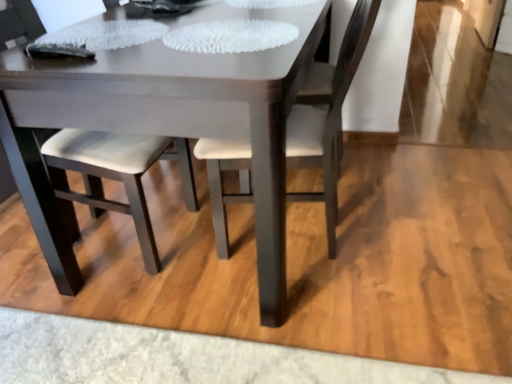
In order to face white leather chair at center, which is the 2th chair in left-to-right order, should I rotate leftwards or rightwards?

Turn right approximately 3.893 degrees to face it.

This screenshot has height=384, width=512. I want to click on white leather chair at center, placed as the first chair when sorted from right to left, so click(x=327, y=115).

Identify the location of matte white table at center. The height and width of the screenshot is (384, 512). (165, 123).

Between matte white chair at center, which appears as the 2th chair when viewed from the right, and matte white table at center, which one has smaller width?

With smaller width is matte white chair at center, which appears as the 2th chair when viewed from the right.

Is matte white chair at center, placed as the 1th chair when sorted from left to right, with matte white table at center?

No.

From a real-world perspective, which is physically above, matte white chair at center, which appears as the 2th chair when viewed from the right, or matte white table at center?

matte white chair at center, which appears as the 2th chair when viewed from the right, is physically above.

Can you tell me how much matte white chair at center, placed as the 1th chair when sorted from left to right, and matte white table at center differ in facing direction?

The angle between the facing direction of matte white chair at center, placed as the 1th chair when sorted from left to right, and the facing direction of matte white table at center is 2.28 degrees.

Consider the image. Between white leather chair at center, placed as the first chair when sorted from right to left, and matte white chair at center, placed as the 1th chair when sorted from left to right, which one is positioned behind?

white leather chair at center, placed as the first chair when sorted from right to left, is further away from the camera.

Considering the points (331, 145) and (190, 196), which point is behind, point (331, 145) or point (190, 196)?

The point (190, 196) is more distant.

How much distance is there between white leather chair at center, which is the 2th chair in left-to-right order, and matte white chair at center, which appears as the 2th chair when viewed from the right?

The distance of white leather chair at center, which is the 2th chair in left-to-right order, from matte white chair at center, which appears as the 2th chair when viewed from the right, is 16.64 inches.

In the scene shown: In terms of height, does white leather chair at center, placed as the first chair when sorted from right to left, look taller or shorter compared to matte white chair at center, placed as the 1th chair when sorted from left to right?

In the image, white leather chair at center, placed as the first chair when sorted from right to left, appears to be shorter than matte white chair at center, placed as the 1th chair when sorted from left to right.

From the image's perspective, does matte white table at center appear higher than white leather chair at center, which is the 2th chair in left-to-right order?

Yes.

Between point (263, 258) and point (294, 112), which one is positioned behind?

Positioned behind is point (294, 112).

Is matte white table at center wider than white leather chair at center, placed as the first chair when sorted from right to left?

Yes, matte white table at center is wider than white leather chair at center, placed as the first chair when sorted from right to left.

Based on the photo, does matte white table at center have a larger size compared to white leather chair at center, placed as the first chair when sorted from right to left?

Indeed, matte white table at center has a larger size compared to white leather chair at center, placed as the first chair when sorted from right to left.

Can you confirm if matte white table at center is taller than matte white chair at center, which appears as the 2th chair when viewed from the right?

Incorrect, the height of matte white table at center is not larger of that of matte white chair at center, which appears as the 2th chair when viewed from the right.

Does matte white table at center have a lesser width compared to matte white chair at center, which appears as the 2th chair when viewed from the right?

No, matte white table at center is not thinner than matte white chair at center, which appears as the 2th chair when viewed from the right.

Is matte white table at center positioned before matte white chair at center, which appears as the 2th chair when viewed from the right?

Yes.

From a real-world perspective, which chair is the 2nd one above the matte white table at center? Please provide its 2D coordinates.

[(115, 176)]

Can you confirm if matte white chair at center, which appears as the 2th chair when viewed from the right, is bigger than white leather chair at center, which is the 2th chair in left-to-right order?

Indeed, matte white chair at center, which appears as the 2th chair when viewed from the right, has a larger size compared to white leather chair at center, which is the 2th chair in left-to-right order.

Is matte white chair at center, placed as the 1th chair when sorted from left to right, to the right of white leather chair at center, which is the 2th chair in left-to-right order, from the viewer's perspective?

Incorrect, matte white chair at center, placed as the 1th chair when sorted from left to right, is not on the right side of white leather chair at center, which is the 2th chair in left-to-right order.

Considering the positions of point (93, 168) and point (323, 184), is point (93, 168) closer or farther from the camera than point (323, 184)?

Point (93, 168) is positioned closer to the camera compared to point (323, 184).

Is matte white chair at center, which appears as the 2th chair when viewed from the right, touching white leather chair at center, placed as the first chair when sorted from right to left?

They are not placed beside each other.

From a real-world perspective, who is located higher, white leather chair at center, which is the 2th chair in left-to-right order, or matte white table at center?

white leather chair at center, which is the 2th chair in left-to-right order, is physically above.

Does white leather chair at center, which is the 2th chair in left-to-right order, have a larger size compared to matte white table at center?

No.

Between white leather chair at center, placed as the first chair when sorted from right to left, and matte white table at center, which one appears on the left side from the viewer's perspective?

matte white table at center is more to the left.

Where is `kitchen & dining room table below the matte white chair at center, placed as the 1th chair when sorted from left to right (from a real-world perspective)`? The height and width of the screenshot is (384, 512). kitchen & dining room table below the matte white chair at center, placed as the 1th chair when sorted from left to right (from a real-world perspective) is located at coordinates (165, 123).

Where is `chair in front of the white leather chair at center, which is the 2th chair in left-to-right order`? Image resolution: width=512 pixels, height=384 pixels. chair in front of the white leather chair at center, which is the 2th chair in left-to-right order is located at coordinates (115, 176).

Based on their spatial positions, is matte white table at center or white leather chair at center, which is the 2th chair in left-to-right order, further from matte white chair at center, which appears as the 2th chair when viewed from the right?

white leather chair at center, which is the 2th chair in left-to-right order.

Looking at the image, which one is located further to white leather chair at center, which is the 2th chair in left-to-right order, matte white table at center or matte white chair at center, placed as the 1th chair when sorted from left to right?

Based on the image, matte white chair at center, placed as the 1th chair when sorted from left to right, appears to be further to white leather chair at center, which is the 2th chair in left-to-right order.

Which object lies nearer to the anchor point matte white table at center, matte white chair at center, which appears as the 2th chair when viewed from the right, or white leather chair at center, which is the 2th chair in left-to-right order?

Based on the image, matte white chair at center, which appears as the 2th chair when viewed from the right, appears to be nearer to matte white table at center.

Considering their positions, is white leather chair at center, placed as the first chair when sorted from right to left, positioned further to matte white table at center than matte white chair at center, which appears as the 2th chair when viewed from the right?

The object further to matte white table at center is white leather chair at center, placed as the first chair when sorted from right to left.

From the picture: Which object lies nearer to the anchor point white leather chair at center, which is the 2th chair in left-to-right order, matte white chair at center, placed as the 1th chair when sorted from left to right, or matte white table at center?

matte white table at center lies closer to white leather chair at center, which is the 2th chair in left-to-right order, than the other object.

From the image, which object appears to be farther from matte white chair at center, placed as the 1th chair when sorted from left to right, white leather chair at center, placed as the first chair when sorted from right to left, or matte white table at center?

white leather chair at center, placed as the first chair when sorted from right to left.

Where is `kitchen & dining room table situated between matte white chair at center, which appears as the 2th chair when viewed from the right, and white leather chair at center, which is the 2th chair in left-to-right order, from left to right`? kitchen & dining room table situated between matte white chair at center, which appears as the 2th chair when viewed from the right, and white leather chair at center, which is the 2th chair in left-to-right order, from left to right is located at coordinates (165, 123).